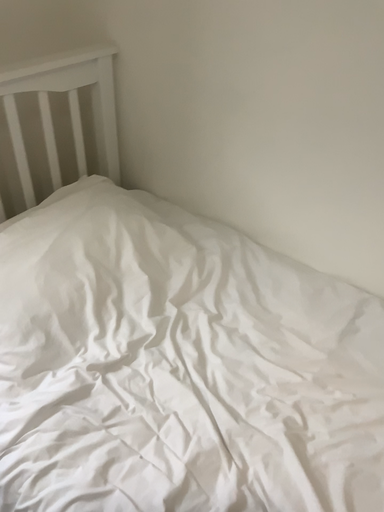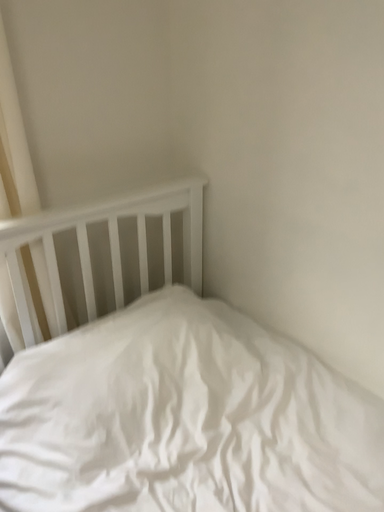
Question: How did the camera likely rotate when shooting the video?

Choices:
 (A) rotated right
 (B) rotated left

Answer: (B)